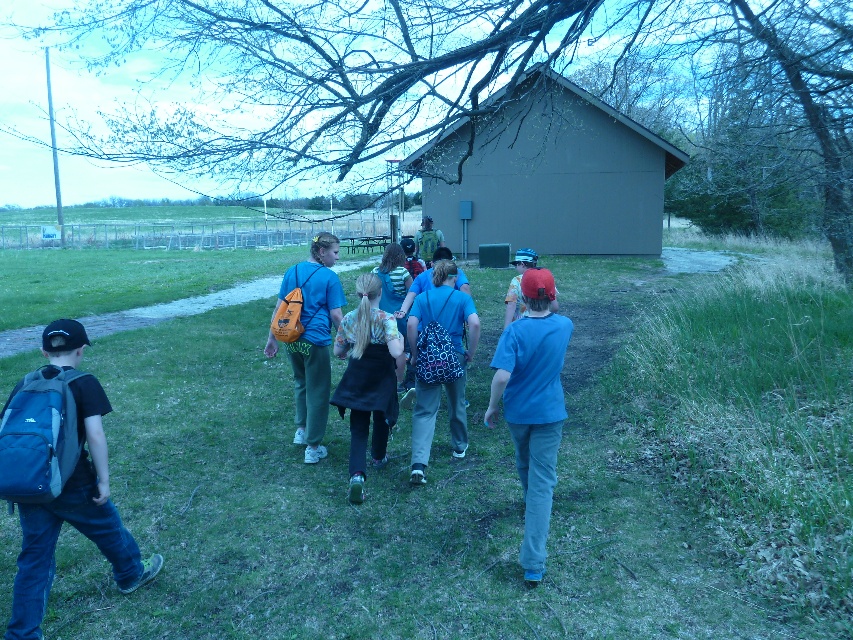
Question: Is blue fabric backpack at left thinner than blue cotton shirt at center?

Choices:
 (A) yes
 (B) no

Answer: (B)

Question: Considering the relative positions of blue fabric backpack at left and blue printed backpack at center in the image provided, where is blue fabric backpack at left located with respect to blue printed backpack at center?

Choices:
 (A) right
 (B) left

Answer: (B)

Question: Which of these objects is positioned closest to the orange fabric backpack at center?

Choices:
 (A) green grass at lower center
 (B) blue printed backpack at center

Answer: (B)

Question: Which point is closer to the camera?

Choices:
 (A) blue printed backpack at center
 (B) brown matte hut at center
 (C) blue cotton shirt at center
 (D) floral fabric dress at center

Answer: (C)

Question: Estimate the real-world distances between objects in this image. Which object is closer to the orange fabric backpack at center?

Choices:
 (A) brown matte hut at center
 (B) blue printed backpack at center
 (C) blue fabric backpack at left
 (D) floral fabric dress at center

Answer: (D)

Question: Is blue fabric backpack at left to the right of blue printed backpack at center from the viewer's perspective?

Choices:
 (A) yes
 (B) no

Answer: (B)